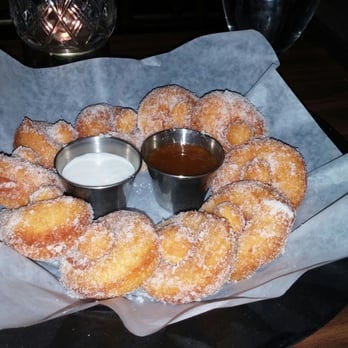
Find the location of a particular element. dish is located at coordinates (161, 194).